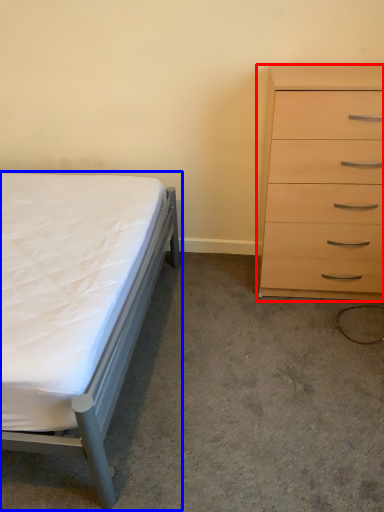
Question: Which point is closer to the camera, chest of drawers (highlighted by a red box) or bed (highlighted by a blue box)?

Choices:
 (A) chest of drawers
 (B) bed

Answer: (B)